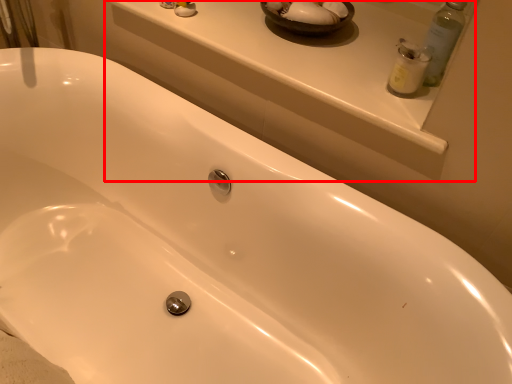
Question: From the image's perspective, where is window sill (annotated by the red box) located relative to cleaning product?

Choices:
 (A) below
 (B) above

Answer: (B)